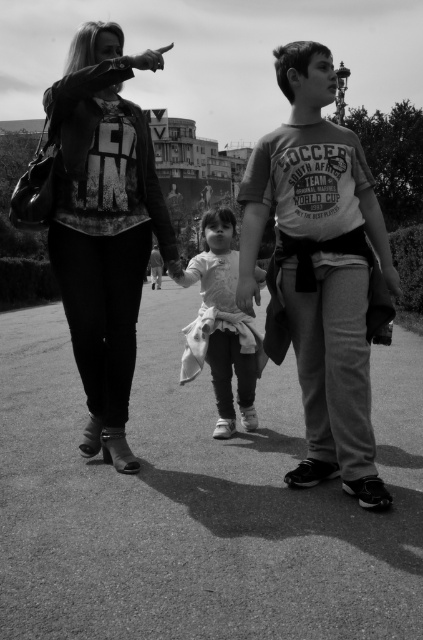
What are the coordinates of the matte black jacket at upper left?

The coordinates of the matte black jacket at upper left are at point (320, 268).